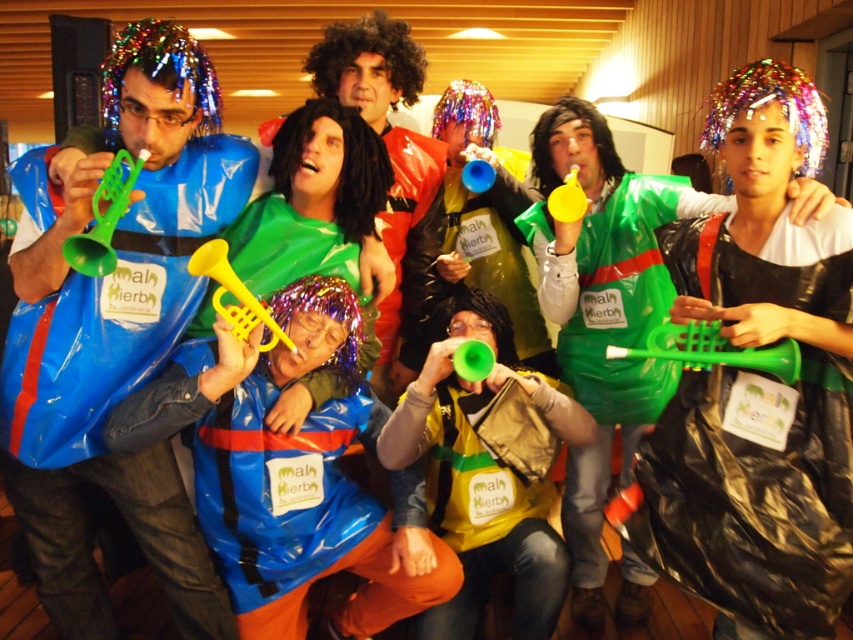
You are standing at the center of the image. Which direction should you move to reach the black plastic bag at right?

Since the black plastic bag at right is located at coordinate point 0.773 on the x axis and 0.885 on the y axis, you should move towards the right and slightly upwards to reach it.

You are organizing a costume party and need to decide which item takes up more horizontal space. Based on the scene description, which object is wider between the black plastic bag at right and the sparkly multicolored wig at upper left?

The black plastic bag at right is wider than the sparkly multicolored wig at upper left according to the description.

You are standing in the hall and want to find the green matte plastic bag at center. Which direction should you look to find it?

The green matte plastic bag at center is located at point (471, 266), so you should look towards the center of the image to find it.